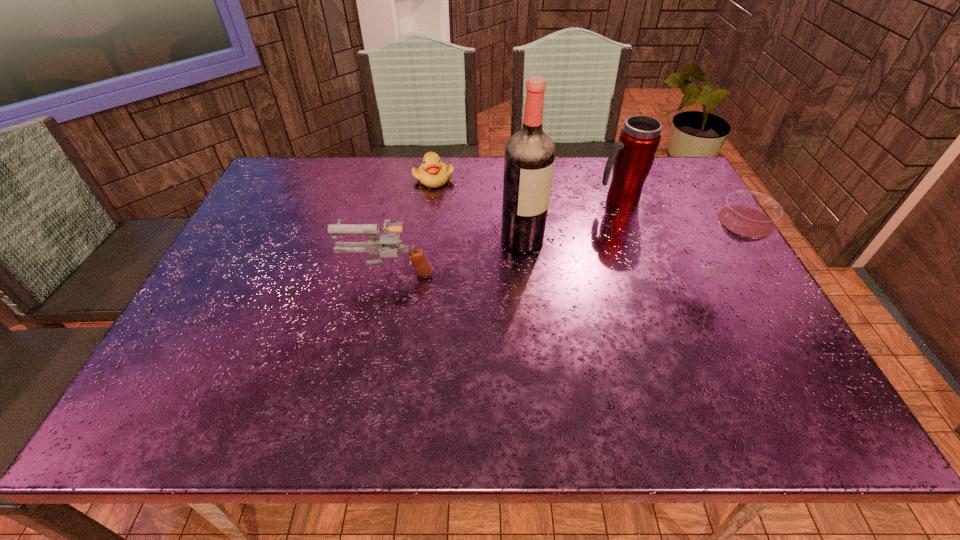
Where is `the closest object to the rightmost object`? The height and width of the screenshot is (540, 960). the closest object to the rightmost object is located at coordinates (632, 156).

What are the coordinates of `the third closest object to the duckling` in the screenshot? It's located at (632, 156).

Find the location of a particular element. The image size is (960, 540). vacant region that satisfies the following two spatial constraints: 1. on the front side of the third object from left to right; 2. on the left side of the wineglass is located at coordinates (526, 273).